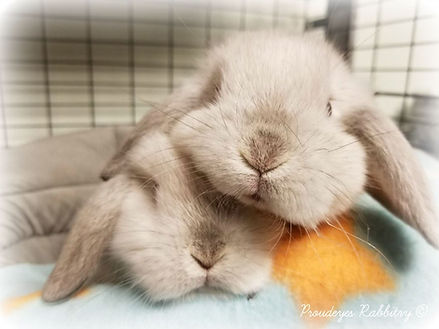
Identify the location of grey bed. (36, 157).